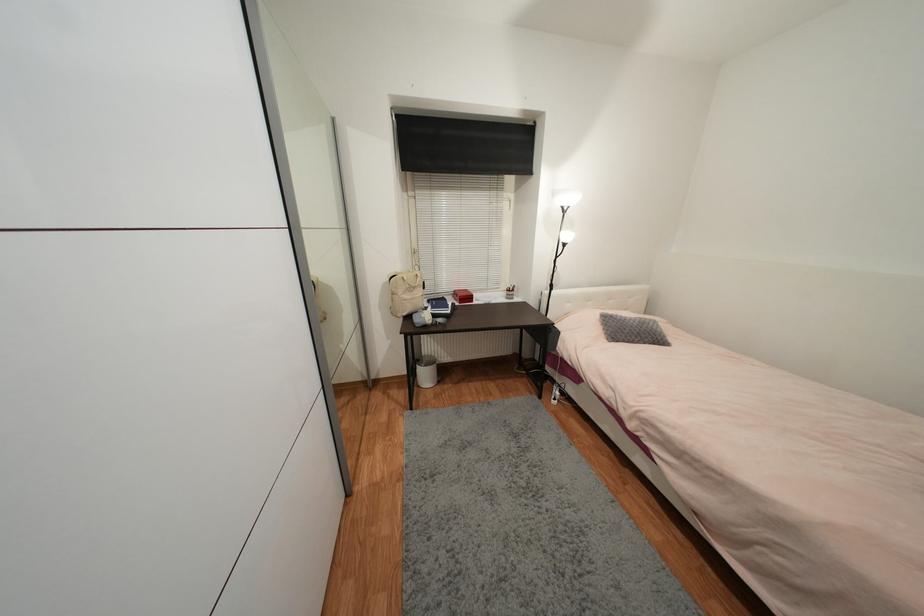
Locate an element on the screen. The image size is (924, 616). white window handle is located at coordinates (415, 254).